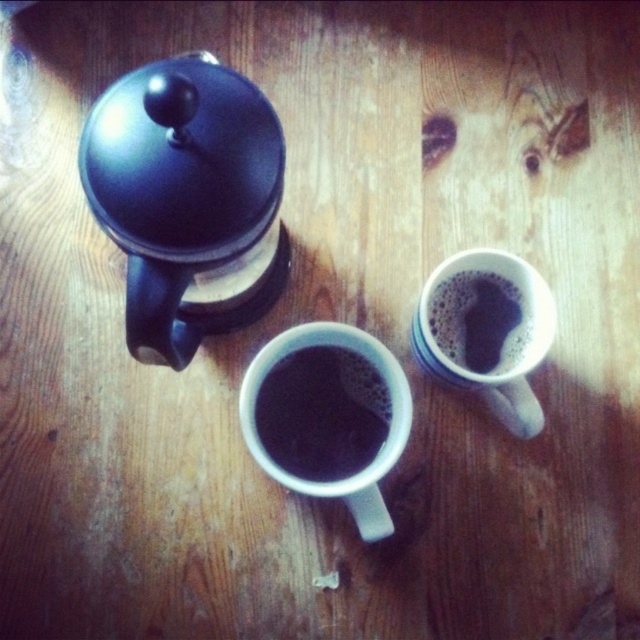
You are standing in front of a rustic wooden table with two white ceramic mugs filled with coffee and a black French press coffee maker. You need to place a small sugar cube exactly at the point labeled as point (x=378, y=451). Which object will the sugar cube be placed closest to?

The point (x=378, y=451) corresponds to the white glossy mug at center, so the sugar cube will be placed closest to the white glossy mug at center.

You are looking at the two points in the image, point 1 at coordinates point (237, 417) and point 2 at coordinates point (484, 333). Which point is closer to the camera?

Point (237, 417) is further to the camera than point (484, 333), so point (484, 333) is closer to the camera.

You are a barista preparing drinks and see the white matte mug at upper right and the satin black coffee at upper right. Which object is positioned more to the right on the wooden surface?

The white matte mug at upper right is positioned more to the right than the satin black coffee at upper right.